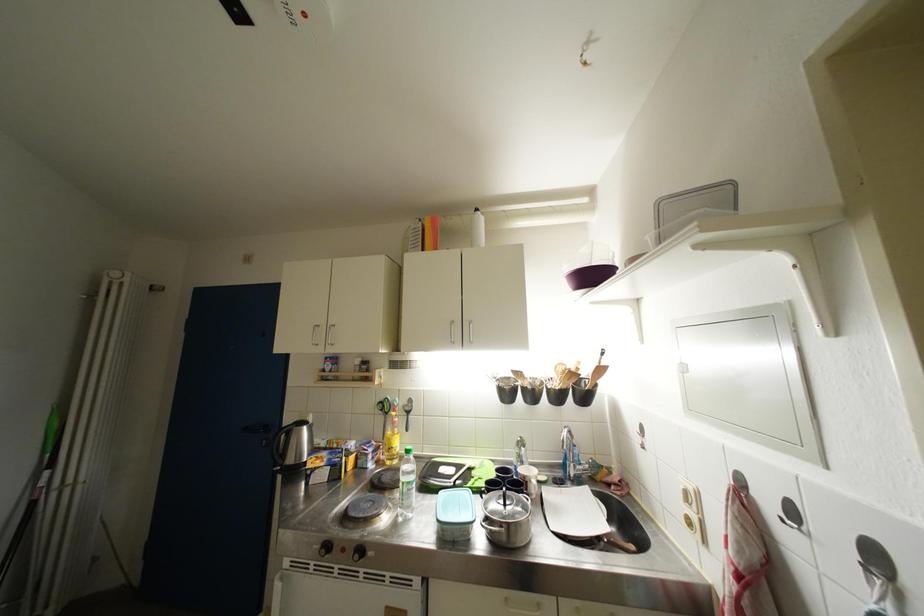
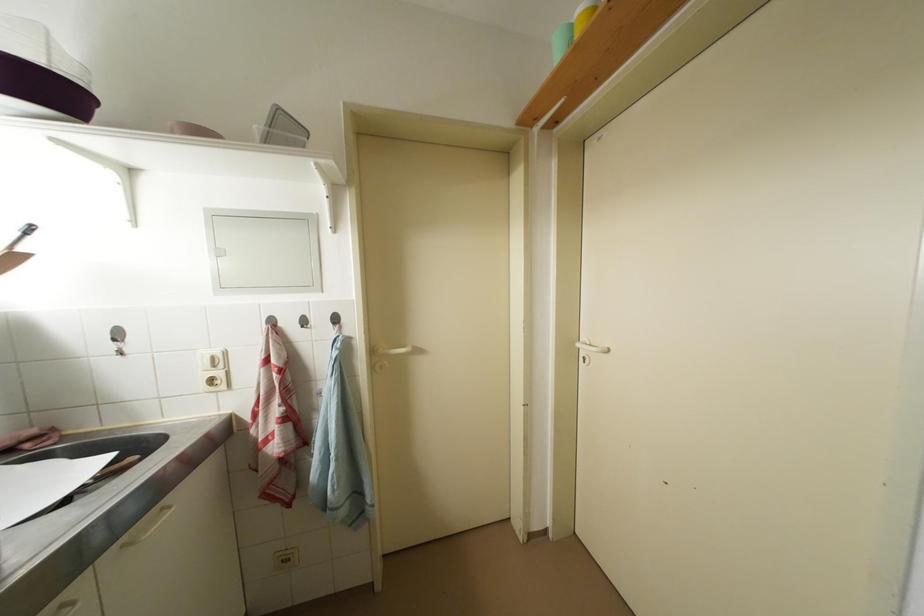
Question: The first image is from the beginning of the video and the second image is from the end. How did the camera likely rotate when shooting the video?

Choices:
 (A) Left
 (B) Right
 (C) Up
 (D) Down

Answer: (B)